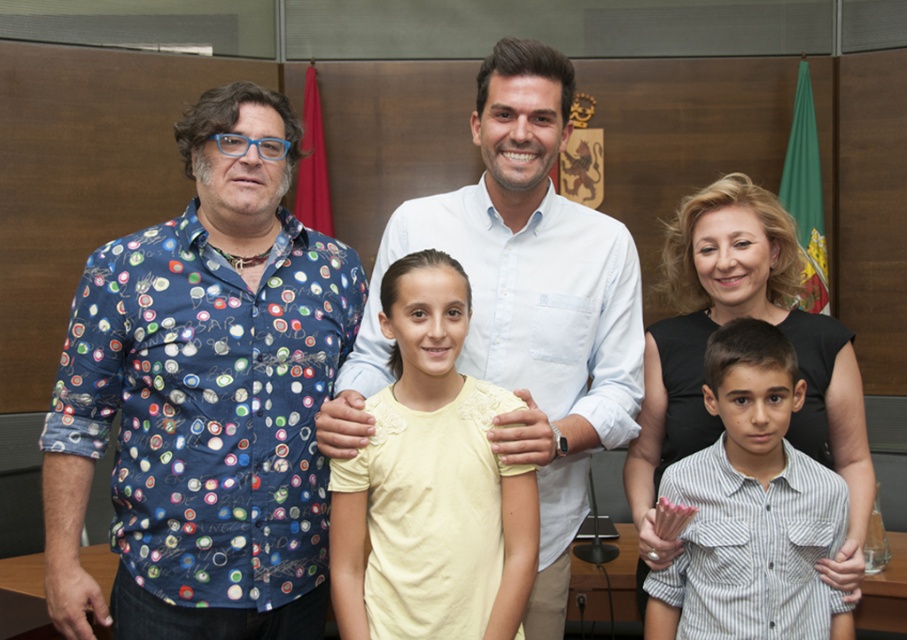
Can you confirm if blue printed shirt at left is positioned to the right of white cotton shirt at center?

In fact, blue printed shirt at left is to the left of white cotton shirt at center.

Is blue printed shirt at left taller than white cotton shirt at center?

Incorrect, blue printed shirt at left's height is not larger of white cotton shirt at center's.

Where is `blue printed shirt at left`? Image resolution: width=907 pixels, height=640 pixels. blue printed shirt at left is located at coordinates click(x=205, y=397).

Does white cotton shirt at center appear on the left side of yellow cotton shirt at center?

Incorrect, white cotton shirt at center is not on the left side of yellow cotton shirt at center.

This screenshot has height=640, width=907. Identify the location of white cotton shirt at center. (523, 305).

Measure the distance between point (x=553, y=557) and camera.

A distance of 1.79 meters exists between point (x=553, y=557) and camera.

Image resolution: width=907 pixels, height=640 pixels. I want to click on white cotton shirt at center, so click(523, 305).

Which is behind, point (159, 593) or point (701, 525)?

The point (701, 525) is more distant.

How far apart are blue printed shirt at left and striped cotton shirt at center?

blue printed shirt at left and striped cotton shirt at center are 35.53 inches apart.

The height and width of the screenshot is (640, 907). What are the coordinates of `blue printed shirt at left` in the screenshot? It's located at (205, 397).